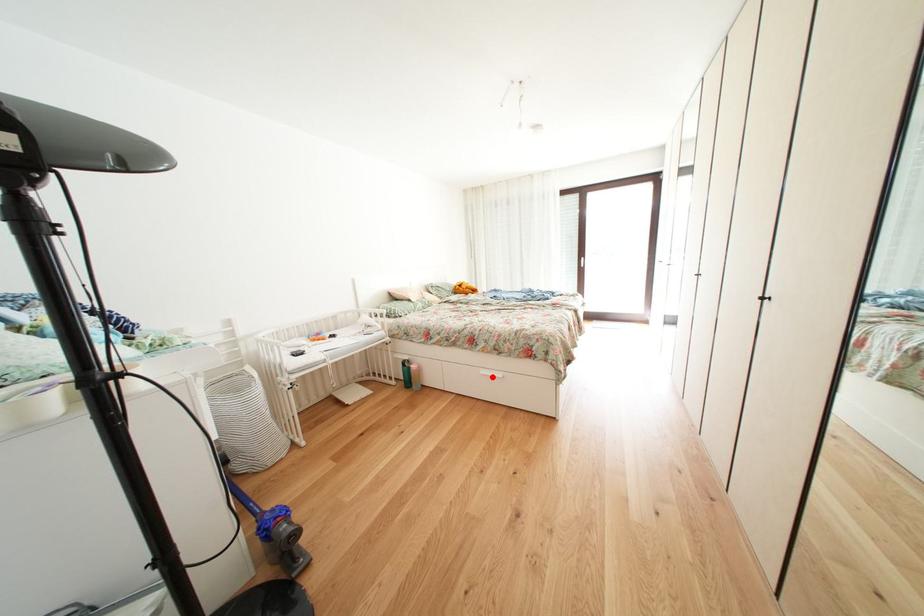
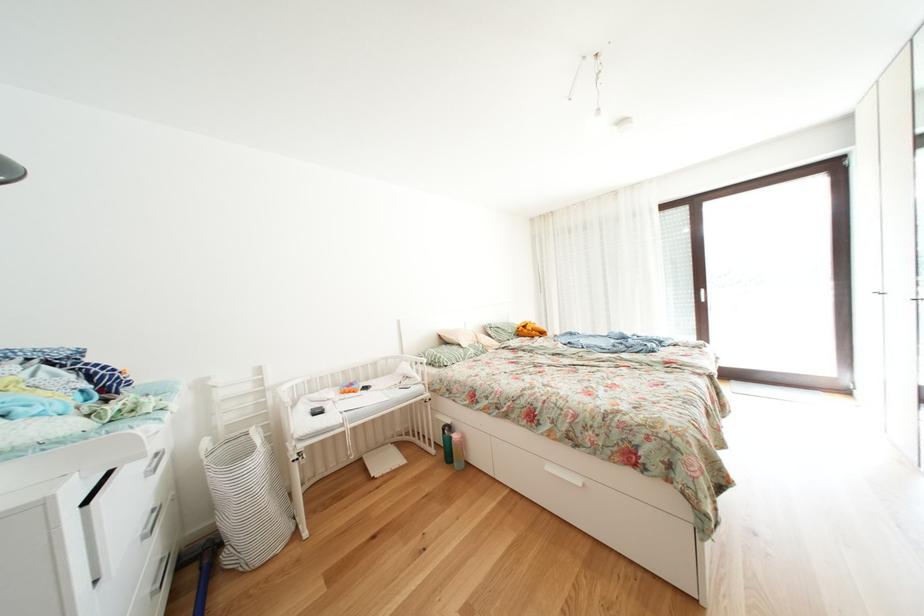
In the second image, find the point that corresponds to the highlighted location in the first image.

(558, 472)